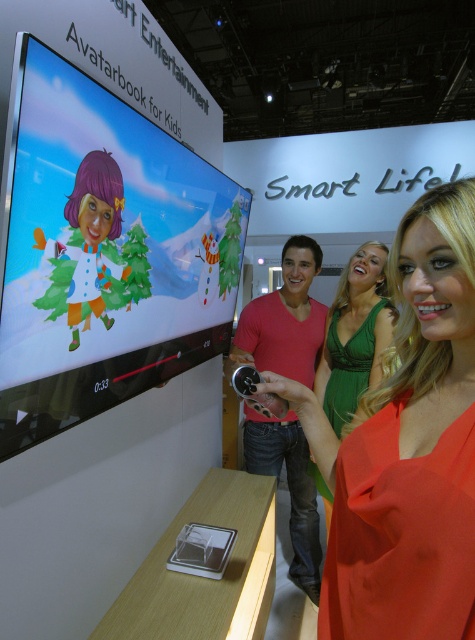
Question: Which of these objects is positioned closest to the orange satin dress at center?

Choices:
 (A) matte red shirt at center
 (B) green satin dress at center

Answer: (B)

Question: Is orange satin dress at center below green satin dress at center?

Choices:
 (A) no
 (B) yes

Answer: (A)

Question: Which point appears closest to the camera in this image?

Choices:
 (A) (466, 355)
 (B) (263, 442)
 (C) (382, 323)

Answer: (A)

Question: Is orange satin dress at center above green satin dress at center?

Choices:
 (A) no
 (B) yes

Answer: (B)

Question: Which object is the closest to the orange satin dress at center?

Choices:
 (A) matte red shirt at center
 (B) green satin dress at center

Answer: (B)

Question: Does orange satin dress at center appear on the left side of matte red shirt at center?

Choices:
 (A) no
 (B) yes

Answer: (A)